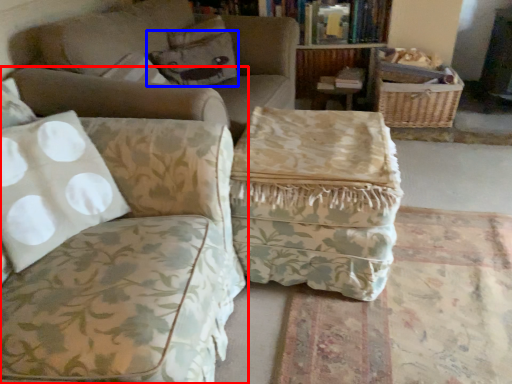
Question: Which of the following is the closest to the observer, studio couch (highlighted by a red box) or pillow (highlighted by a blue box)?

Choices:
 (A) studio couch
 (B) pillow

Answer: (A)